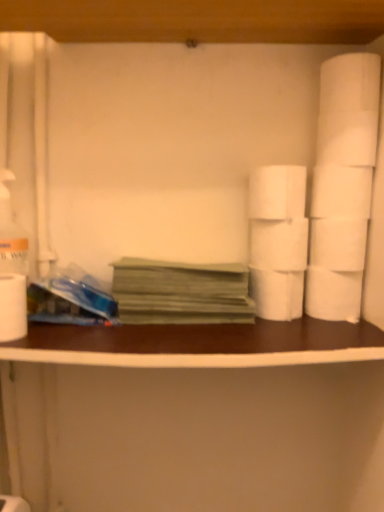
Question: Does white matte toilet paper at right, marked as the 6th toilet paper in a left-to-right arrangement, appear on the right side of white matte toilet paper at right, the 4th toilet paper in the left-to-right sequence?

Choices:
 (A) no
 (B) yes

Answer: (B)

Question: From a real-world perspective, does white matte toilet paper at right, placed as the third toilet paper when sorted from right to left, sit lower than white matte toilet paper at right, arranged as the fifth toilet paper when viewed from the right?

Choices:
 (A) no
 (B) yes

Answer: (A)

Question: From the image's perspective, would you say white matte toilet paper at right, placed as the third toilet paper when sorted from right to left, is shown under white matte toilet paper at right, arranged as the fifth toilet paper when viewed from the right?

Choices:
 (A) no
 (B) yes

Answer: (B)

Question: From the image's perspective, is white matte toilet paper at right, placed as the third toilet paper when sorted from right to left, above white matte toilet paper at right, the 4th toilet paper in the left-to-right sequence?

Choices:
 (A) no
 (B) yes

Answer: (A)

Question: Is white matte toilet paper at right, placed as the third toilet paper when sorted from right to left, thinner than white matte toilet paper at right, arranged as the fifth toilet paper when viewed from the right?

Choices:
 (A) yes
 (B) no

Answer: (A)

Question: Is white matte toilet paper at right, marked as the 6th toilet paper in a left-to-right arrangement, facing towards white matte toilet paper at right, the 4th toilet paper in the left-to-right sequence?

Choices:
 (A) no
 (B) yes

Answer: (A)

Question: From the image's perspective, is white matte toilet paper at left, which is the 8th toilet paper in right-to-left order, below white matte toilet paper at right, marked as the 6th toilet paper in a left-to-right arrangement?

Choices:
 (A) yes
 (B) no

Answer: (A)

Question: Considering the relative sizes of white matte toilet paper at left, which is the 8th toilet paper in right-to-left order, and white matte toilet paper at right, placed as the third toilet paper when sorted from right to left, in the image provided, is white matte toilet paper at left, which is the 8th toilet paper in right-to-left order, taller than white matte toilet paper at right, placed as the third toilet paper when sorted from right to left,?

Choices:
 (A) no
 (B) yes

Answer: (B)

Question: Considering the relative sizes of white matte toilet paper at left, which is the 8th toilet paper in right-to-left order, and white matte toilet paper at right, placed as the third toilet paper when sorted from right to left, in the image provided, is white matte toilet paper at left, which is the 8th toilet paper in right-to-left order, thinner than white matte toilet paper at right, placed as the third toilet paper when sorted from right to left,?

Choices:
 (A) no
 (B) yes

Answer: (B)

Question: Is white matte toilet paper at left, which is the 8th toilet paper in right-to-left order, outside of white matte toilet paper at right, marked as the 6th toilet paper in a left-to-right arrangement?

Choices:
 (A) yes
 (B) no

Answer: (A)

Question: From a real-world perspective, is white matte toilet paper at left, which is the 8th toilet paper in right-to-left order, on top of white matte toilet paper at right, placed as the third toilet paper when sorted from right to left?

Choices:
 (A) yes
 (B) no

Answer: (B)

Question: Is white matte toilet paper at left, which is the 8th toilet paper in right-to-left order, in contact with white matte toilet paper at right, placed as the third toilet paper when sorted from right to left?

Choices:
 (A) no
 (B) yes

Answer: (A)

Question: Can white matte toilet paper at right, arranged as the fifth toilet paper when viewed from the right, be found inside white matte toilet paper at right, the fifth toilet paper positioned from the left?

Choices:
 (A) no
 (B) yes

Answer: (A)